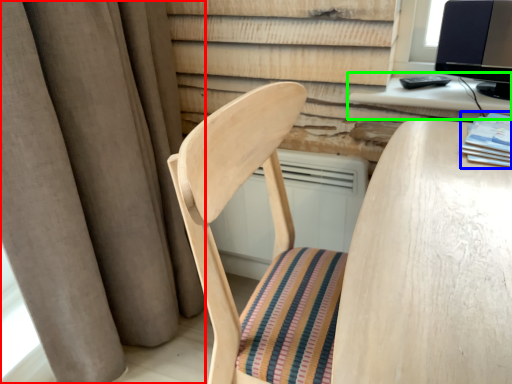
Question: Considering the real-world distances, which object is closest to curtain (highlighted by a red box)? book (highlighted by a blue box) or computer desk (highlighted by a green box).

Choices:
 (A) book
 (B) computer desk

Answer: (B)